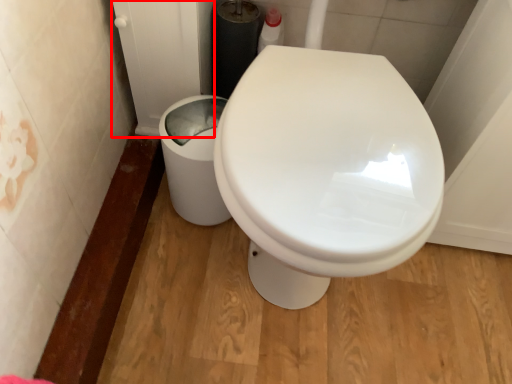
Question: From the image's perspective, where is screen door (annotated by the red box) located in relation to porcelain in the image?

Choices:
 (A) below
 (B) above

Answer: (B)